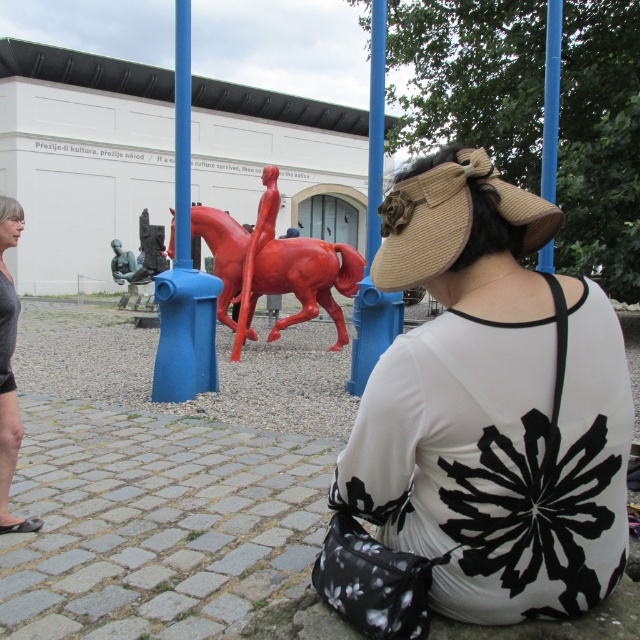
I want to click on shiny red horse at center, so click(276, 273).

Who is more distant from viewer, (x=260, y=264) or (x=13, y=396)?

Positioned behind is point (x=260, y=264).

Measure the distance between shiny red horse at center and camera.

The distance of shiny red horse at center from camera is 9.83 meters.

Image resolution: width=640 pixels, height=640 pixels. I want to click on shiny red horse at center, so click(276, 273).

Does shiny red horse at center have a larger size compared to brushed metal statue at center?

No, shiny red horse at center is not bigger than brushed metal statue at center.

Is point (228, 268) behind point (163, 241)?

No, (228, 268) is in front of (163, 241).

This screenshot has height=640, width=640. What are the coordinates of `shiny red horse at center` in the screenshot? It's located at (276, 273).

Does point (12, 435) come farther from viewer compared to point (128, 273)?

No, (12, 435) is closer to viewer.

Does gray fabric pants at lower left have a greater height compared to brushed metal statue at center?

No, gray fabric pants at lower left is not taller than brushed metal statue at center.

Is point (16, 301) farther from viewer compared to point (145, 236)?

No, (16, 301) is closer to viewer.

The image size is (640, 640). In order to click on gray fabric pants at lower left in this screenshot , I will do `click(8, 369)`.